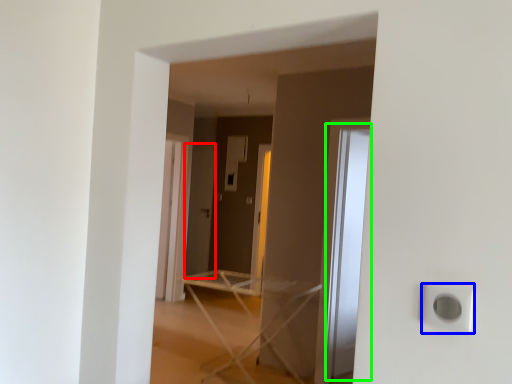
Question: Which object is positioned farthest from screen door (highlighted by a red box)? Select from electric outlet (highlighted by a blue box) and glass door (highlighted by a green box).

Choices:
 (A) electric outlet
 (B) glass door

Answer: (A)